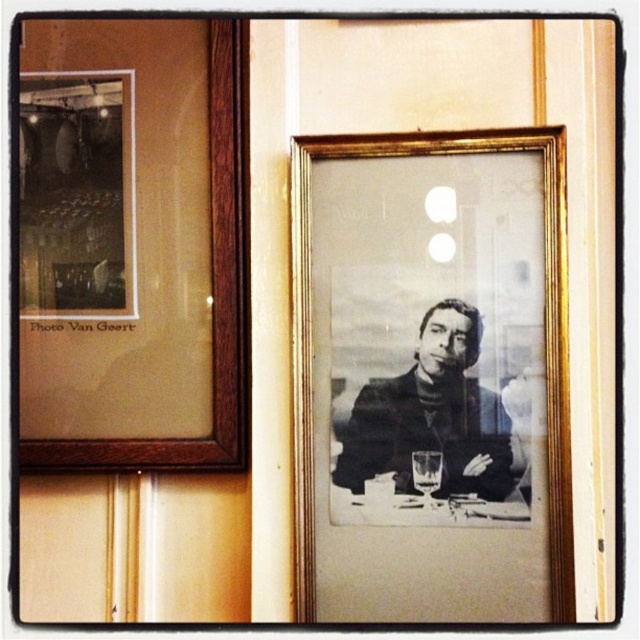
Does gold metallic picture frame at center appear under black matte portrait at center?

No, gold metallic picture frame at center is not below black matte portrait at center.

In the scene shown: Does gold metallic picture frame at center have a smaller size compared to black matte portrait at center?

No, gold metallic picture frame at center is not smaller than black matte portrait at center.

Does point (477, 291) come behind point (488, 442)?

Yes, point (477, 291) is farther from viewer.

Identify the location of gold metallic picture frame at center. This screenshot has width=640, height=640. (432, 378).

Is wooden photo frame at left thinner than black matte portrait at center?

No, wooden photo frame at left is not thinner than black matte portrait at center.

Is point (147, 209) farther from viewer compared to point (436, 496)?

Yes, it is.

This screenshot has width=640, height=640. What are the coordinates of `wooden photo frame at left` in the screenshot? It's located at (131, 244).

You are a GUI agent. You are given a task and a screenshot of the screen. Output one action in this format:
    pyautogui.click(x=<x>, y=<y>)
    Task: Click on the gold metallic picture frame at center
    
    Given the screenshot: What is the action you would take?
    pyautogui.click(x=432, y=378)

Does gold metallic picture frame at center have a lesser width compared to wooden photo frame at left?

Incorrect, gold metallic picture frame at center's width is not less than wooden photo frame at left's.

This screenshot has width=640, height=640. Identify the location of gold metallic picture frame at center. (432, 378).

I want to click on gold metallic picture frame at center, so click(x=432, y=378).